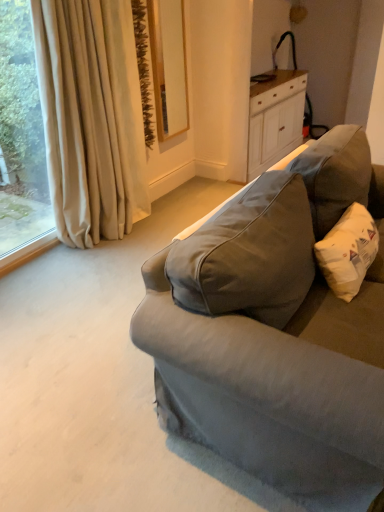
The width and height of the screenshot is (384, 512). I want to click on vacant area that lies to the right of beige fabric curtain at left, so click(162, 224).